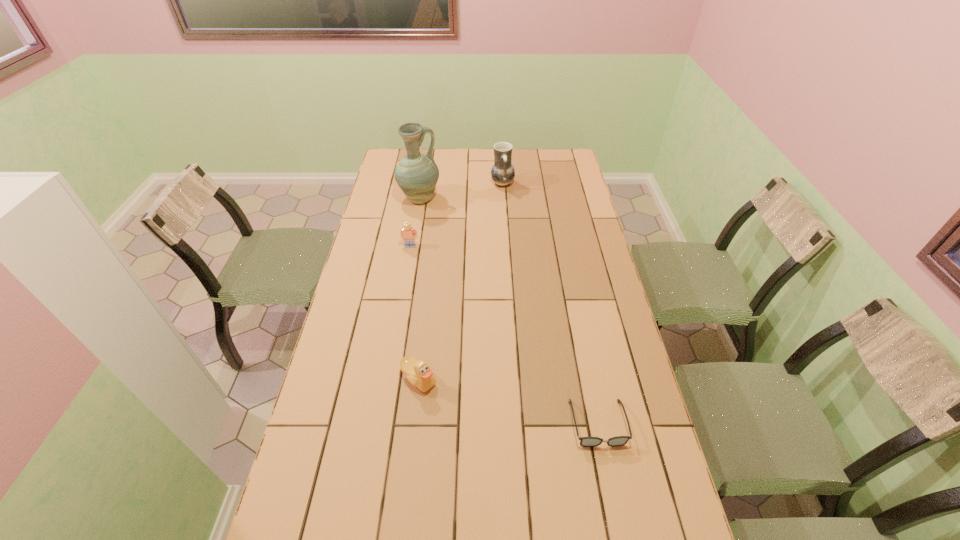
Find the location of a particular element. free region located 0.300m on the front-facing side of the third farthest object is located at coordinates (399, 307).

The image size is (960, 540). I want to click on vacant space located 0.170m at the beak of the duck, so click(410, 455).

At what (x,y) coordinates should I click in order to perform the action: click on free space located on the face of the shortest object. Please return your answer as a coordinate pair (x, y). The image size is (960, 540). Looking at the image, I should click on (616, 516).

You are a GUI agent. You are given a task and a screenshot of the screen. Output one action in this format:
    pyautogui.click(x=<x>, y=<y>)
    Task: Click on the pitcher positioned at the left edge
    The width and height of the screenshot is (960, 540).
    Given the screenshot: What is the action you would take?
    pyautogui.click(x=417, y=174)

Identify the location of Lego at the left edge. The image size is (960, 540). (408, 232).

What are the coordinates of `object located in the right edge section of the desktop` in the screenshot? It's located at (618, 440).

Locate an element on the screen. The image size is (960, 540). free space at the far edge of the desktop is located at coordinates (453, 169).

Locate an element on the screen. The image size is (960, 540). vacant position at the left edge of the desktop is located at coordinates (291, 514).

This screenshot has height=540, width=960. Identify the location of vacant region at the right edge of the desktop. (564, 181).

Image resolution: width=960 pixels, height=540 pixels. Identify the location of vacant space in between the Lego and the fourth object from left to right. (456, 215).